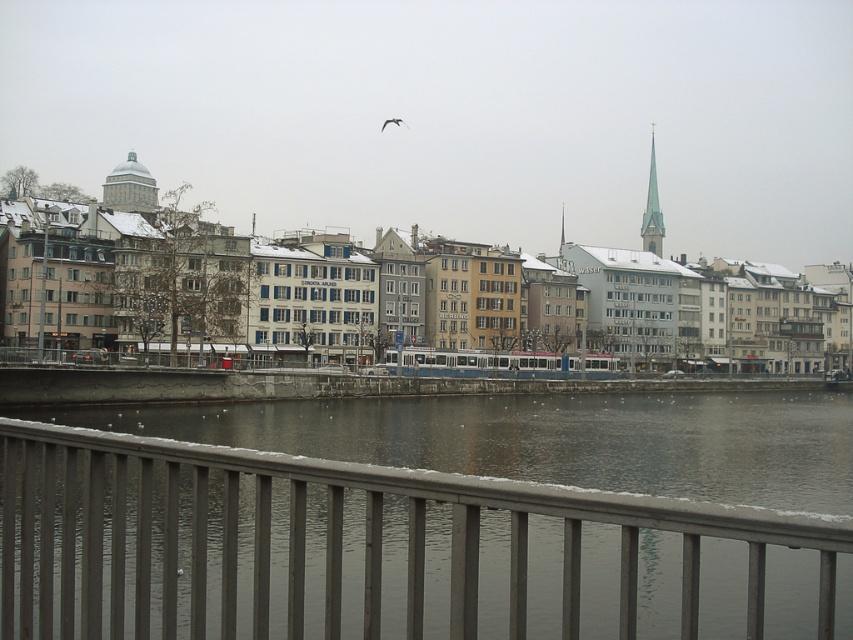
Is metal/rustic rail at lower center positioned behind white stone spire at upper right?

No, metal/rustic rail at lower center is closer to the viewer.

Which of these two, metal/rustic rail at lower center or white stone spire at upper right, stands shorter?

metal/rustic rail at lower center

Between point (665, 621) and point (653, 252), which one is positioned behind?

The point (653, 252) is behind.

Where is `metal/rustic rail at lower center`? metal/rustic rail at lower center is located at coordinates (381, 550).